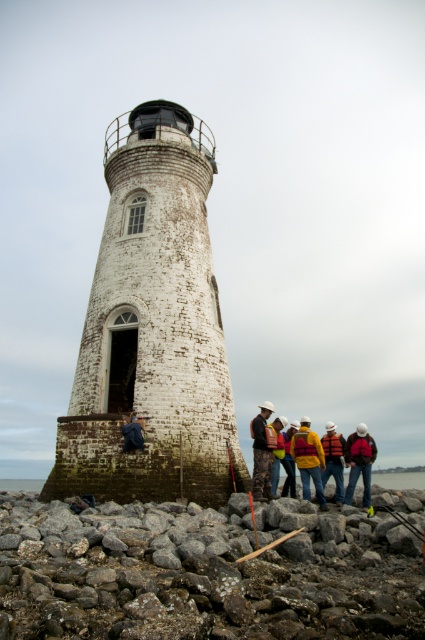
You are a maintenance worker standing at the coordinates 0.5, 0.35. Can you reach the white stone tower at center from your current position?

The white stone tower at center is located at point (x=152, y=328), which is very close to your current position at (x=148, y=320). You can easily reach it by moving a short distance forward.

You are a maintenance worker at the lighthouse and need to secure a safety rope between the white stone tower at center and the orange life vest at center. Considering their heights, which object will require the rope to be tied higher?

The white stone tower at center has a greater height compared to the orange life vest at center, so the rope must be tied higher on the white stone tower at center.

You are a maintenance worker on the rocky shoreline near the lighthouse. You need to place a 2 meter wide equipment container between the gray rough stone at lower left and the white stone tower at center. Can the container fit between them?

The gray rough stone at lower left is wider than the white stone tower at center. However, the exact distance between them isn not specified in the objects description. Therefore, it is impossible to determine if the container will fit based on the given information.